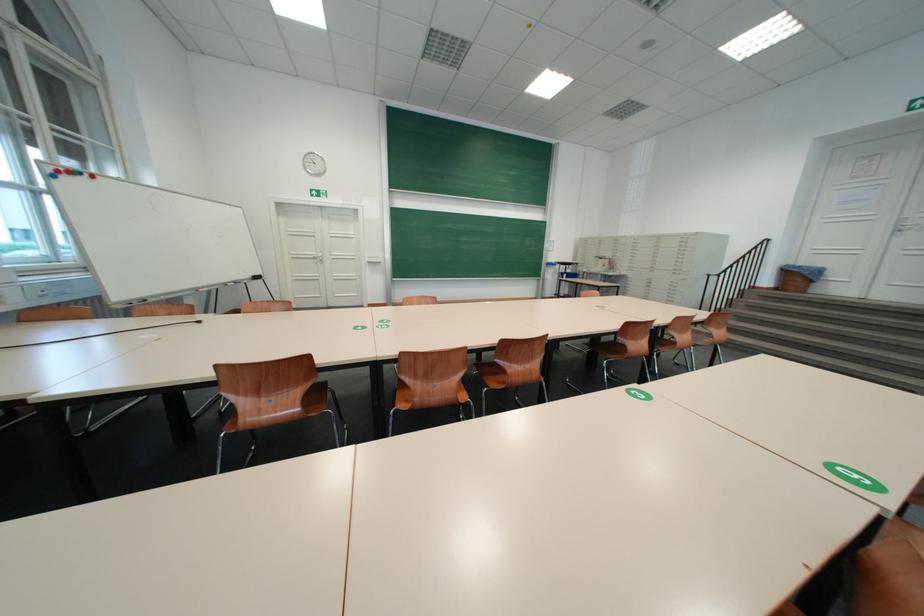
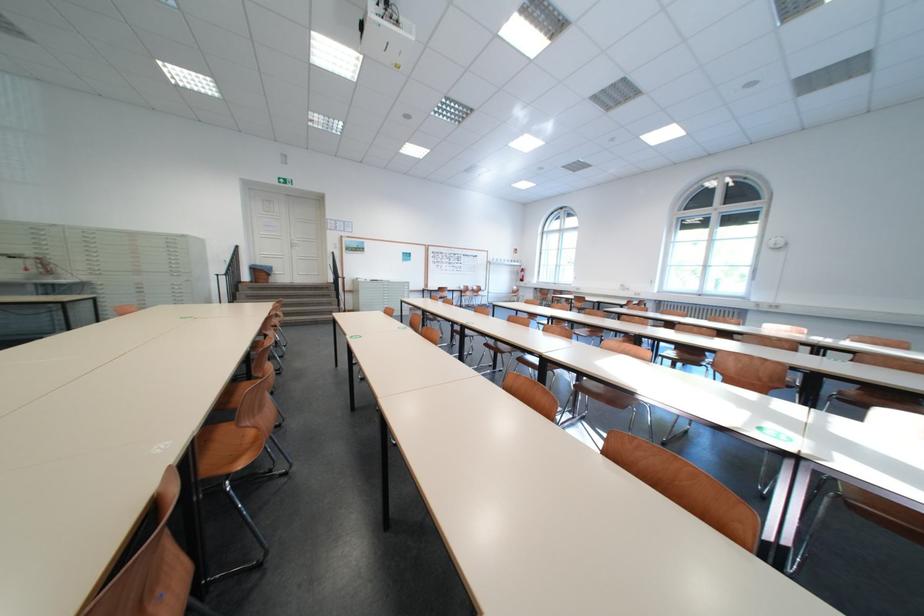
Question: I am providing you with two images of the same scene from different viewpoints. Which of the following objects are not visible in image2?

Choices:
 (A) black metal railing
 (B) red fire extinguisher
 (C) brown chair sitting surface
 (D) small green knob

Answer: (C)